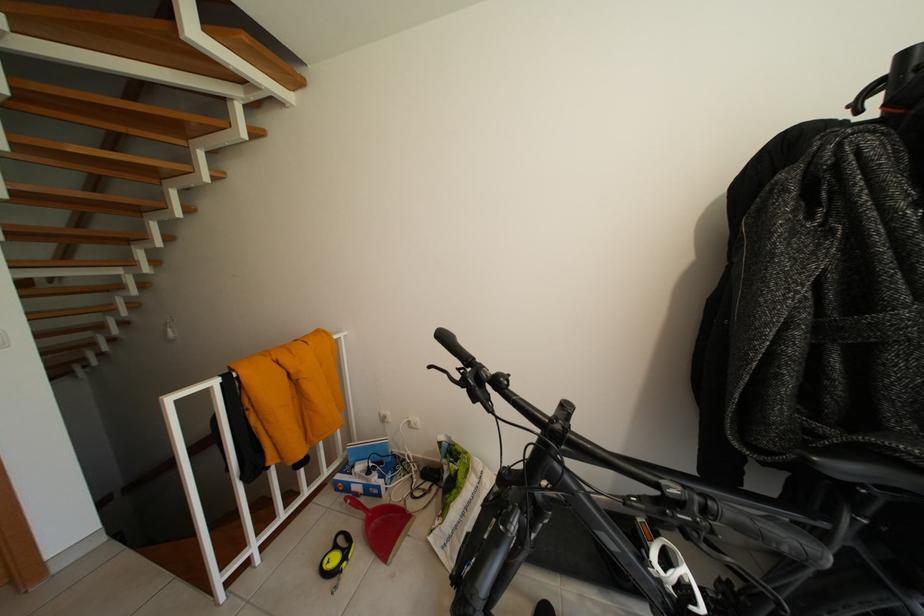
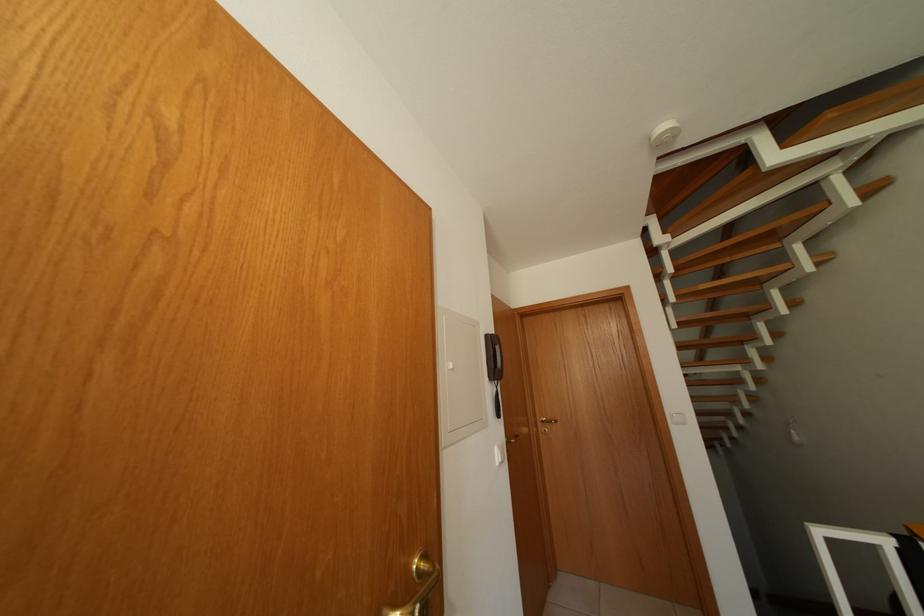
Question: How did the camera likely rotate?

Choices:
 (A) Left
 (B) Right
 (C) Up
 (D) Down

Answer: (A)